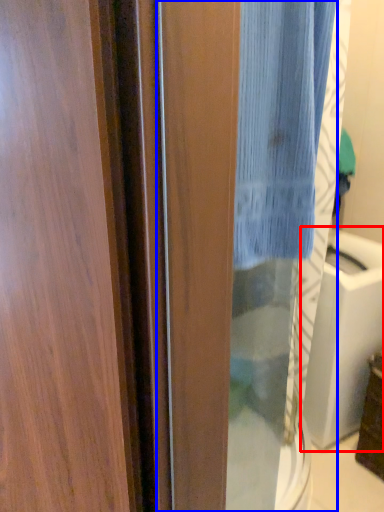
Question: Which of the following is the farthest to the observer, sink (highlighted by a red box) or screen door (highlighted by a blue box)?

Choices:
 (A) sink
 (B) screen door

Answer: (A)